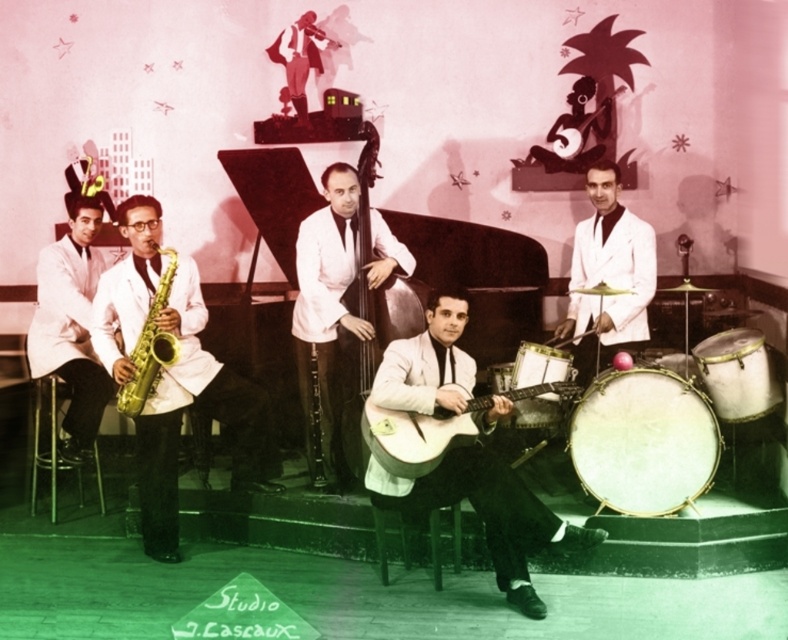
Which is more to the left, white matte bass at center or white drum at lower right?

Positioned to the left is white matte bass at center.

Who is more distant from viewer, [305,336] or [536,381]?

The point [305,336] is behind.

Find the location of `white matte bass at center`. white matte bass at center is located at coordinates (326, 284).

Between white matte bass at center and white matte suit at right, which one appears on the right side from the viewer's perspective?

Positioned to the right is white matte suit at right.

Does white matte bass at center appear over white matte suit at right?

Actually, white matte bass at center is below white matte suit at right.

Between point (322, 179) and point (608, 170), which one is positioned in front?

Positioned in front is point (322, 179).

You are a GUI agent. You are given a task and a screenshot of the screen. Output one action in this format:
    pyautogui.click(x=<x>, y=<y>)
    Task: Click on the white matte bass at center
    
    Given the screenshot: What is the action you would take?
    pyautogui.click(x=326, y=284)

Between point (428, 330) and point (666, 358), which one is positioned in front?

Positioned in front is point (428, 330).

What are the coordinates of `light wood acoustic guitar at center` in the screenshot? It's located at (489, 515).